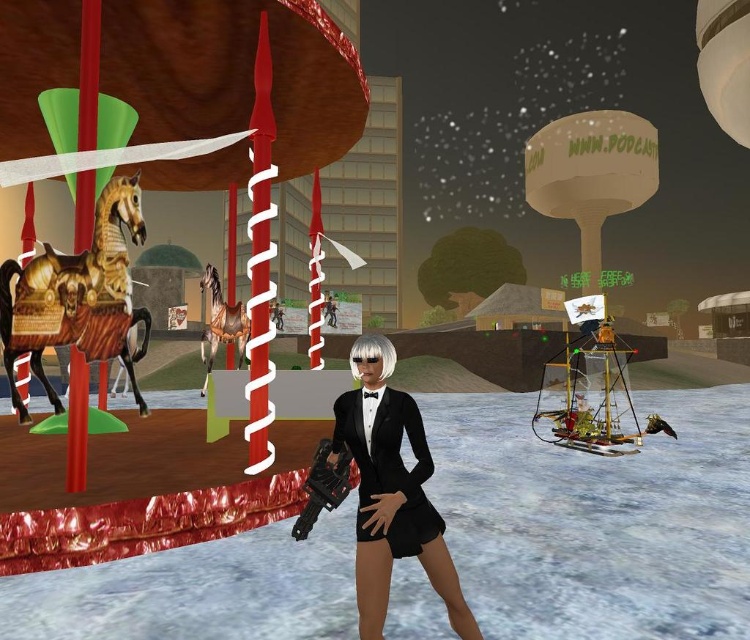
Question: Which object is farther from the camera taking this photo?

Choices:
 (A) golden polished wood horse at left
 (B) gold polished wood horse at left

Answer: (B)

Question: Which object appears farthest from the camera in this image?

Choices:
 (A) black satin business suit at center
 (B) golden polished wood horse at left

Answer: (B)

Question: Can you confirm if black satin dress at center is positioned to the right of shiny gold horse at left?

Choices:
 (A) no
 (B) yes

Answer: (B)

Question: Considering the relative positions of black satin business suit at center and golden polished wood horse at left in the image provided, where is black satin business suit at center located with respect to golden polished wood horse at left?

Choices:
 (A) right
 (B) left

Answer: (A)

Question: Does black satin dress at center lie behind black satin business suit at center?

Choices:
 (A) yes
 (B) no

Answer: (B)

Question: Estimate the real-world distances between objects in this image. Which object is closer to the black satin dress at center?

Choices:
 (A) black satin business suit at center
 (B) gold polished wood horse at left
 (C) golden polished wood horse at left

Answer: (A)